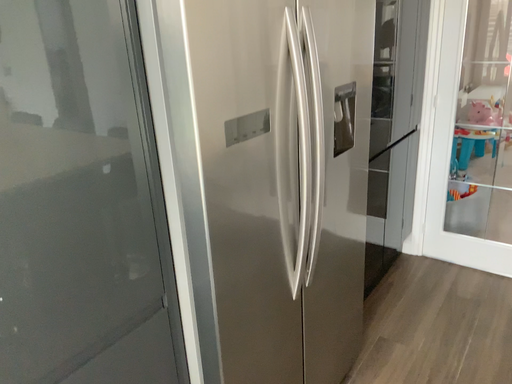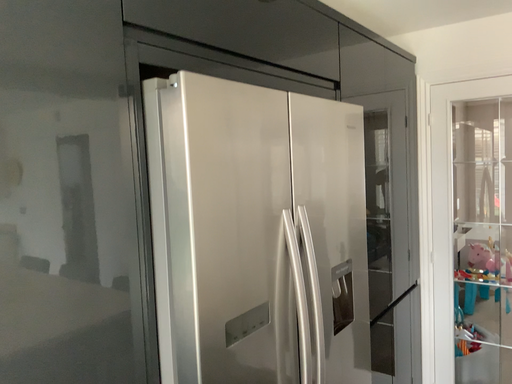
Question: How did the camera likely rotate when shooting the video?

Choices:
 (A) rotated upward
 (B) rotated downward

Answer: (A)